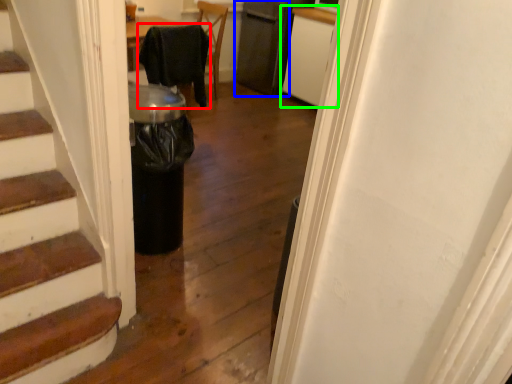
Question: Based on their relative distances, which object is farther from chair (highlighted by a red box)? Choose from appliance (highlighted by a blue box) and cabinetry (highlighted by a green box).

Choices:
 (A) appliance
 (B) cabinetry

Answer: (A)